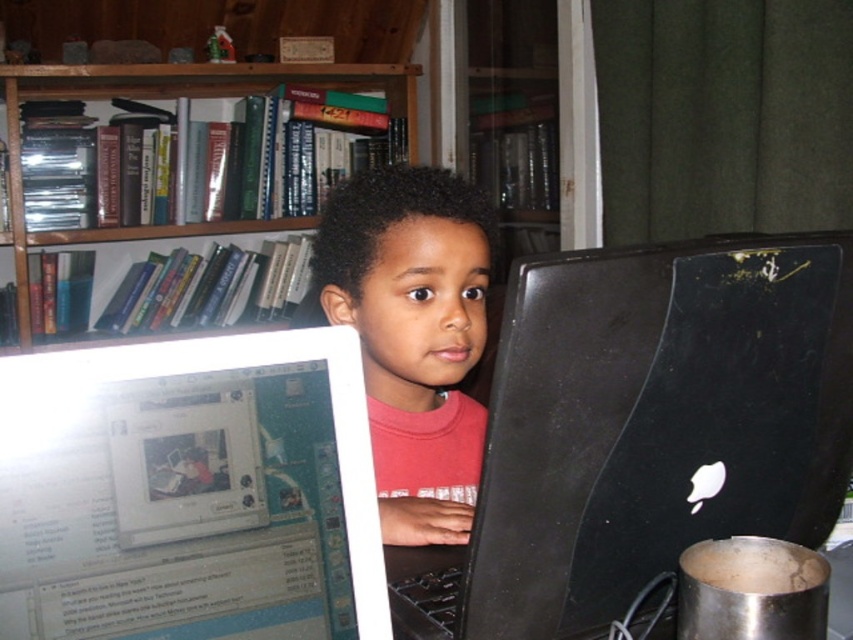
Question: Can you confirm if white glossy computer screen at center is positioned to the right of wooden bookshelf at upper left?

Choices:
 (A) yes
 (B) no

Answer: (A)

Question: Which of the following is the closest to the observer?

Choices:
 (A) pink matte shirt at center
 (B) black matte laptop at center

Answer: (B)

Question: Considering the relative positions of black matte laptop at center and wooden bookshelf at upper left in the image provided, where is black matte laptop at center located with respect to wooden bookshelf at upper left?

Choices:
 (A) right
 (B) left

Answer: (A)

Question: Which point appears farthest from the camera in this image?

Choices:
 (A) (390, 266)
 (B) (815, 273)
 (C) (22, 257)

Answer: (C)

Question: Which object appears closest to the camera in this image?

Choices:
 (A) white glossy computer screen at center
 (B) black matte laptop at center
 (C) pink matte shirt at center
 (D) wooden bookshelf at upper left

Answer: (A)

Question: Is white glossy computer screen at center below wooden bookshelf at upper left?

Choices:
 (A) no
 (B) yes

Answer: (B)